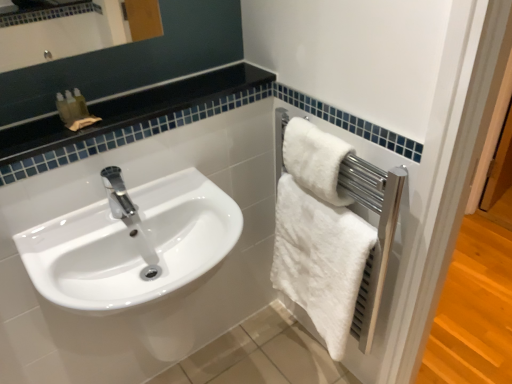
I want to click on black glossy countertop at upper left, so click(129, 110).

Where is `white glossy sink at left`? white glossy sink at left is located at coordinates (132, 244).

Measure the distance between point [143,288] and camera.

A distance of 1.01 meters exists between point [143,288] and camera.

This screenshot has height=384, width=512. Describe the element at coordinates (320, 259) in the screenshot. I see `white fluffy towel at right, the first towel ordered from the bottom` at that location.

Where is `black glossy countertop at upper left`? The width and height of the screenshot is (512, 384). black glossy countertop at upper left is located at coordinates pyautogui.click(x=129, y=110).

Considering the relative sizes of white fluffy towel at right, the first towel ordered from the bottom, and white fluffy towel at right, the first towel in the top-to-bottom sequence, in the image provided, is white fluffy towel at right, the first towel ordered from the bottom, taller than white fluffy towel at right, the first towel in the top-to-bottom sequence,?

Yes.

Locate an element on the screen. Image resolution: width=512 pixels, height=384 pixels. towel located above the white fluffy towel at right, the first towel ordered from the bottom (from a real-world perspective) is located at coordinates (315, 160).

Can you confirm if white fluffy towel at right, the second towel from the top, is bigger than white fluffy towel at right, which is counted as the 2th towel, starting from the bottom?

Yes.

How far apart are white fluffy towel at right, the first towel ordered from the bottom, and white fluffy towel at right, which is counted as the 2th towel, starting from the bottom?

The distance of white fluffy towel at right, the first towel ordered from the bottom, from white fluffy towel at right, which is counted as the 2th towel, starting from the bottom, is 8.52 inches.

From a real-world perspective, is white glossy sink at left positioned over black glossy countertop at upper left based on gravity?

No.

Is white glossy sink at left touching black glossy countertop at upper left?

No, white glossy sink at left is not in contact with black glossy countertop at upper left.

From the picture: From the image's perspective, is white glossy sink at left on top of black glossy countertop at upper left?

No.

In the scene shown: Would you say white glossy sink at left contains black glossy countertop at upper left?

No.

From the image's perspective, is white fluffy towel at right, which is counted as the 2th towel, starting from the bottom, located beneath white fluffy towel at right, the second towel from the top?

No, from the image's perspective, white fluffy towel at right, which is counted as the 2th towel, starting from the bottom, is not beneath white fluffy towel at right, the second towel from the top.

Looking at this image, does white fluffy towel at right, the first towel in the top-to-bottom sequence, have a greater width compared to white fluffy towel at right, the second towel from the top?

No, white fluffy towel at right, the first towel in the top-to-bottom sequence, is not wider than white fluffy towel at right, the second towel from the top.

How far apart are white fluffy towel at right, the first towel in the top-to-bottom sequence, and white fluffy towel at right, the first towel ordered from the bottom?

white fluffy towel at right, the first towel in the top-to-bottom sequence, is 8.52 inches from white fluffy towel at right, the first towel ordered from the bottom.

From a real-world perspective, does black glossy countertop at upper left sit lower than white glossy sink at left?

No, from a real-world perspective, black glossy countertop at upper left is not below white glossy sink at left.

Can you confirm if black glossy countertop at upper left is thinner than white glossy sink at left?

Indeed, black glossy countertop at upper left has a lesser width compared to white glossy sink at left.

Could you tell me if black glossy countertop at upper left is facing white glossy sink at left?

No, black glossy countertop at upper left is not aimed at white glossy sink at left.

How different are the orientations of black glossy countertop at upper left and white glossy sink at left in degrees?

They differ by 0.276 degrees in their facing directions.

Considering the relative sizes of white glossy sink at left and white fluffy towel at right, the first towel in the top-to-bottom sequence, in the image provided, is white glossy sink at left smaller than white fluffy towel at right, the first towel in the top-to-bottom sequence,?

No, white glossy sink at left is not smaller than white fluffy towel at right, the first towel in the top-to-bottom sequence.

How much distance is there between white glossy sink at left and white fluffy towel at right, the first towel in the top-to-bottom sequence?

white glossy sink at left is 44.39 centimeters from white fluffy towel at right, the first towel in the top-to-bottom sequence.

Which object is closer to the camera, white glossy sink at left or white fluffy towel at right, the first towel in the top-to-bottom sequence?

white glossy sink at left is in front.

From the picture: From the image's perspective, which is below, white glossy sink at left or white fluffy towel at right, which is counted as the 2th towel, starting from the bottom?

white glossy sink at left is shown below in the image.

Do you think white fluffy towel at right, which is counted as the 2th towel, starting from the bottom, is within white glossy sink at left, or outside of it?

white fluffy towel at right, which is counted as the 2th towel, starting from the bottom, is spatially situated outside white glossy sink at left.

Can you tell me how much white fluffy towel at right, which is counted as the 2th towel, starting from the bottom, and white glossy sink at left differ in facing direction?

The facing directions of white fluffy towel at right, which is counted as the 2th towel, starting from the bottom, and white glossy sink at left are 89.4 degrees apart.

Which object is more forward, white fluffy towel at right, the first towel in the top-to-bottom sequence, or white glossy sink at left?

white glossy sink at left is more forward.

Where is `the 1st towel to the right when counting from the white glossy sink at left`? This screenshot has width=512, height=384. the 1st towel to the right when counting from the white glossy sink at left is located at coordinates coord(315,160).

From a real-world perspective, relative to white fluffy towel at right, which is counted as the 2th towel, starting from the bottom, is black glossy countertop at upper left vertically above or below?

In terms of real-world spatial position, black glossy countertop at upper left is above white fluffy towel at right, which is counted as the 2th towel, starting from the bottom.

Looking at the image, does black glossy countertop at upper left seem bigger or smaller compared to white fluffy towel at right, which is counted as the 2th towel, starting from the bottom?

Clearly, black glossy countertop at upper left is larger in size than white fluffy towel at right, which is counted as the 2th towel, starting from the bottom.

Can we say black glossy countertop at upper left lies outside white fluffy towel at right, the first towel in the top-to-bottom sequence?

That's correct, black glossy countertop at upper left is outside of white fluffy towel at right, the first towel in the top-to-bottom sequence.

Considering the sizes of black glossy countertop at upper left and white fluffy towel at right, the first towel in the top-to-bottom sequence, in the image, is black glossy countertop at upper left wider or thinner than white fluffy towel at right, the first towel in the top-to-bottom sequence,?

In the image, black glossy countertop at upper left appears to be wider than white fluffy towel at right, the first towel in the top-to-bottom sequence.

Locate an element on the screen. The width and height of the screenshot is (512, 384). towel on the left of white fluffy towel at right, the second towel from the top is located at coordinates (315, 160).

Identify the location of balustrade located behind the white glossy sink at left. Image resolution: width=512 pixels, height=384 pixels. (129, 110).

Which object lies further to the anchor point white glossy sink at left, white fluffy towel at right, the second towel from the top, or white fluffy towel at right, which is counted as the 2th towel, starting from the bottom?

Based on the image, white fluffy towel at right, which is counted as the 2th towel, starting from the bottom, appears to be further to white glossy sink at left.

Looking at the image, which one is located further to white glossy sink at left, black glossy countertop at upper left or white fluffy towel at right, the second towel from the top?

white fluffy towel at right, the second towel from the top, is positioned further to the anchor white glossy sink at left.

Looking at the image, which one is located further to white glossy sink at left, white fluffy towel at right, the first towel in the top-to-bottom sequence, or black glossy countertop at upper left?

white fluffy towel at right, the first towel in the top-to-bottom sequence, is positioned further to the anchor white glossy sink at left.

Which object lies further to the anchor point white fluffy towel at right, which is counted as the 2th towel, starting from the bottom, white fluffy towel at right, the first towel ordered from the bottom, or white glossy sink at left?

Among the two, white glossy sink at left is located further to white fluffy towel at right, which is counted as the 2th towel, starting from the bottom.

Looking at this image, estimate the real-world distances between objects in this image. Which object is closer to white fluffy towel at right, the first towel ordered from the bottom, black glossy countertop at upper left or white fluffy towel at right, which is counted as the 2th towel, starting from the bottom?

white fluffy towel at right, which is counted as the 2th towel, starting from the bottom, is closer to white fluffy towel at right, the first towel ordered from the bottom.

Consider the image. Based on their spatial positions, is black glossy countertop at upper left or white fluffy towel at right, which is counted as the 2th towel, starting from the bottom, closer to white glossy sink at left?

Among the two, black glossy countertop at upper left is located nearer to white glossy sink at left.

When comparing their distances from white fluffy towel at right, the first towel in the top-to-bottom sequence, does white glossy sink at left or black glossy countertop at upper left seem further?

A: white glossy sink at left is positioned further to the anchor white fluffy towel at right, the first towel in the top-to-bottom sequence.

When comparing their distances from black glossy countertop at upper left, does white glossy sink at left or white fluffy towel at right, the first towel ordered from the bottom, seem further?

The object further to black glossy countertop at upper left is white fluffy towel at right, the first towel ordered from the bottom.

Where is `towel between black glossy countertop at upper left and white fluffy towel at right, the first towel ordered from the bottom`? towel between black glossy countertop at upper left and white fluffy towel at right, the first towel ordered from the bottom is located at coordinates (315, 160).

This screenshot has width=512, height=384. What are the coordinates of `towel between white glossy sink at left and white fluffy towel at right, the first towel ordered from the bottom` in the screenshot? It's located at 315,160.